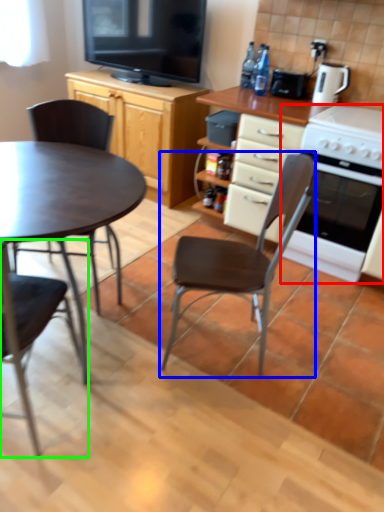
Question: Based on their relative distances, which object is nearer to oven (highlighted by a red box)? Choose from chair (highlighted by a blue box) and chair (highlighted by a green box).

Choices:
 (A) chair
 (B) chair

Answer: (A)